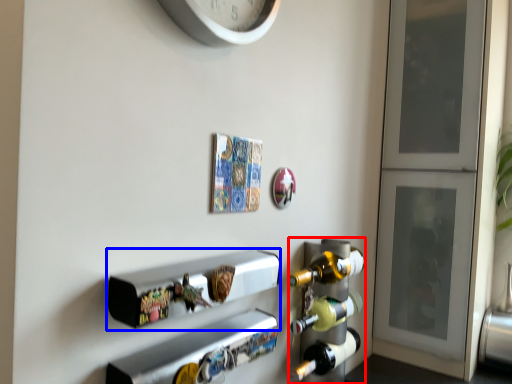
Question: Which point is closer to the camera, wine rack (highlighted by a red box) or shelf (highlighted by a blue box)?

Choices:
 (A) wine rack
 (B) shelf

Answer: (B)